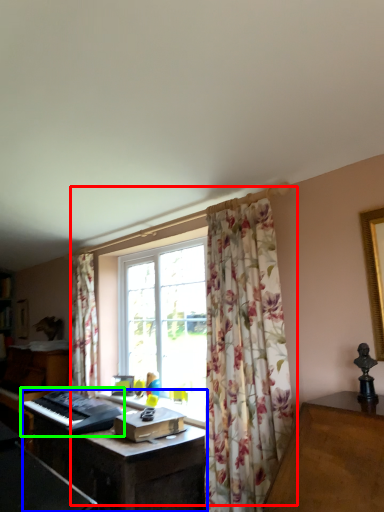
Question: Which object is positioned farthest from window (highlighted by a red box)? Select from computer desk (highlighted by a blue box) and musical keyboard (highlighted by a green box).

Choices:
 (A) computer desk
 (B) musical keyboard

Answer: (B)